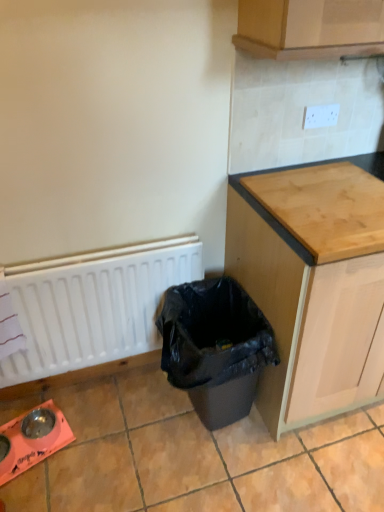
The image size is (384, 512). What are the coordinates of `empty space that is ontop of light brown wood at upper right` in the screenshot? It's located at (327, 199).